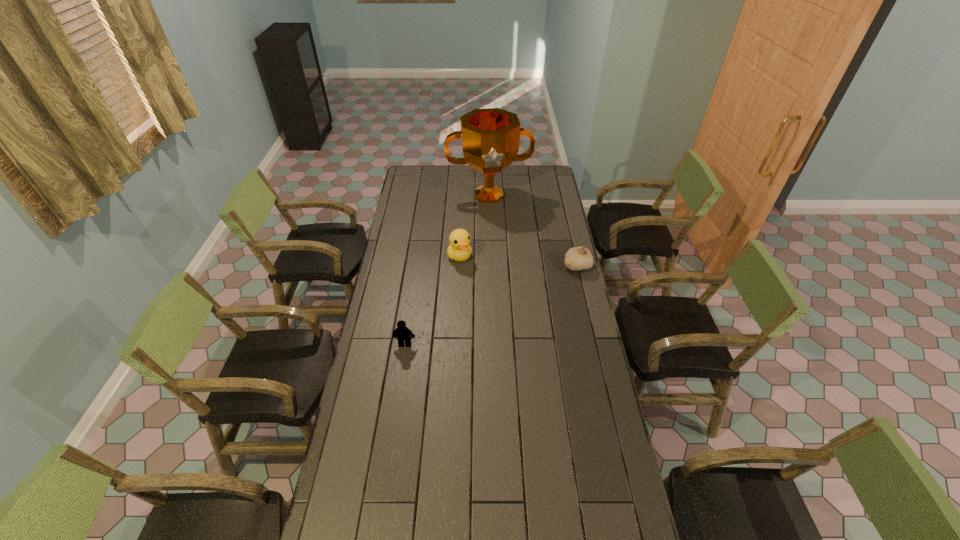
The image size is (960, 540). In the image, there is a desktop. In order to click on vacant region at the right edge in this screenshot , I will do `click(572, 342)`.

Where is `vacant region between the award and the duck`? Image resolution: width=960 pixels, height=540 pixels. vacant region between the award and the duck is located at coordinates (474, 226).

Where is `vacant region between the garlic and the leftmost object`? This screenshot has height=540, width=960. vacant region between the garlic and the leftmost object is located at coordinates (491, 305).

What are the coordinates of `vacant area that lies between the third shortest object and the nearest object` in the screenshot? It's located at (432, 300).

This screenshot has height=540, width=960. What are the coordinates of `blank region between the rightmost object and the tallest object` in the screenshot? It's located at coord(533,231).

In order to click on vacant space that's between the award and the duck in this screenshot , I will do `click(474, 226)`.

Where is `vacant space that is in between the tallest object and the garlic`? This screenshot has height=540, width=960. vacant space that is in between the tallest object and the garlic is located at coordinates (533, 231).

This screenshot has height=540, width=960. What are the coordinates of `vacant space in between the second tallest object and the farthest object` in the screenshot? It's located at (474, 226).

Locate an element on the screen. free space between the farthest object and the leftmost object is located at coordinates (446, 269).

Locate an element on the screen. Image resolution: width=960 pixels, height=540 pixels. vacant area between the leftmost object and the tallest object is located at coordinates (446, 269).